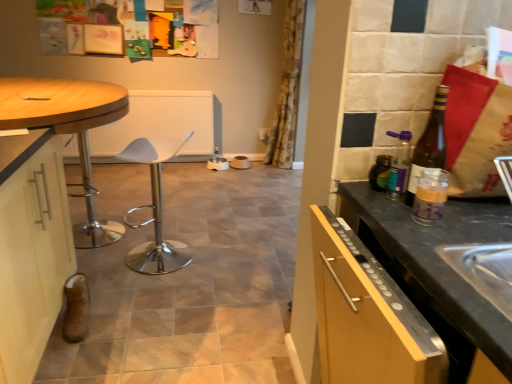
Question: Considering the relative sizes of matte white cabinet at left and translucent plastic jar at right, which ranks as the 1th bottle in front-to-back order, in the image provided, is matte white cabinet at left bigger than translucent plastic jar at right, which ranks as the 1th bottle in front-to-back order,?

Choices:
 (A) no
 (B) yes

Answer: (B)

Question: Is matte white cabinet at left closer to camera compared to translucent plastic jar at right, the 3th bottle from the back?

Choices:
 (A) yes
 (B) no

Answer: (A)

Question: Does matte white cabinet at left appear on the left side of translucent plastic jar at right, the 3th bottle from the back?

Choices:
 (A) yes
 (B) no

Answer: (A)

Question: Is translucent plastic jar at right, the 3th bottle from the back, surrounded by matte white cabinet at left?

Choices:
 (A) no
 (B) yes

Answer: (A)

Question: Is matte white cabinet at left at the right side of translucent plastic jar at right, which ranks as the 1th bottle in front-to-back order?

Choices:
 (A) no
 (B) yes

Answer: (A)

Question: Can you confirm if matte white cabinet at left is taller than translucent plastic jar at right, which ranks as the 1th bottle in front-to-back order?

Choices:
 (A) yes
 (B) no

Answer: (A)

Question: From the image's perspective, is translucent glass bottle at right, acting as the 2th bottle starting from the front, under wooden polished table at left?

Choices:
 (A) no
 (B) yes

Answer: (A)

Question: Can you confirm if translucent glass bottle at right, acting as the 2th bottle starting from the front, is taller than wooden polished table at left?

Choices:
 (A) no
 (B) yes

Answer: (A)

Question: Can you confirm if translucent glass bottle at right, acting as the 2th bottle starting from the front, is wider than wooden polished table at left?

Choices:
 (A) no
 (B) yes

Answer: (A)

Question: From a real-world perspective, is translucent glass bottle at right, acting as the 2th bottle starting from the front, on top of wooden polished table at left?

Choices:
 (A) no
 (B) yes

Answer: (B)

Question: Could you tell me if translucent glass bottle at right, acting as the 2th bottle starting from the back, is turned towards wooden polished table at left?

Choices:
 (A) no
 (B) yes

Answer: (A)

Question: Is translucent glass bottle at right, acting as the 2th bottle starting from the back, directly adjacent to wooden polished table at left?

Choices:
 (A) no
 (B) yes

Answer: (A)

Question: Does wooden polished table at left appear on the left side of white plastic bar stool at center?

Choices:
 (A) yes
 (B) no

Answer: (A)